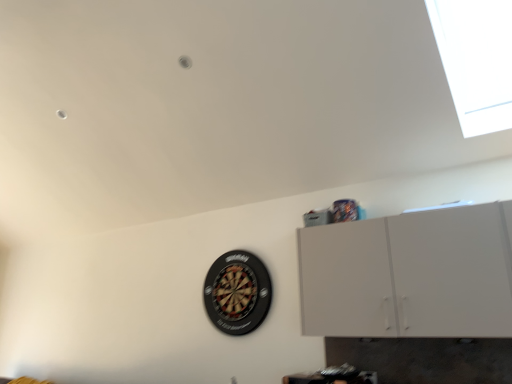
Question: Does point (249, 261) appear closer or farther from the camera than point (446, 61)?

Choices:
 (A) closer
 (B) farther

Answer: (B)

Question: Is black plastic dartboard at center bigger or smaller than transparent glass window at upper right?

Choices:
 (A) small
 (B) big

Answer: (A)

Question: Which object is the closest to the transparent glass window at upper right?

Choices:
 (A) black plastic dartboard at center
 (B) white matte cabinet at upper right

Answer: (B)

Question: Which is farther from the white matte cabinet at upper right?

Choices:
 (A) black plastic dartboard at center
 (B) transparent glass window at upper right

Answer: (A)